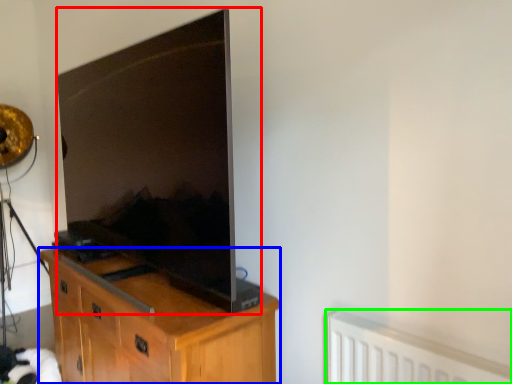
Question: Which object is the farthest from television (highlighted by a red box)? Choose among these: cabinetry (highlighted by a blue box) or radiator (highlighted by a green box).

Choices:
 (A) cabinetry
 (B) radiator

Answer: (B)